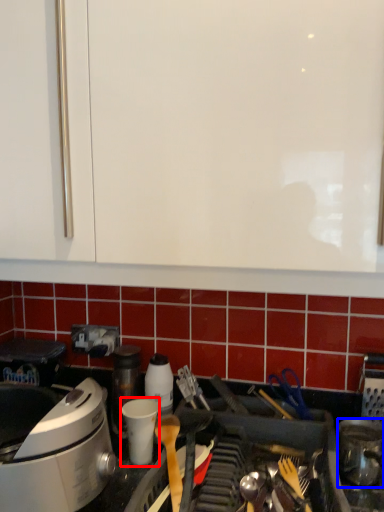
Question: Which of the following is the closest to the observer, appliance (highlighted by a red box) or kitchen appliance (highlighted by a blue box)?

Choices:
 (A) appliance
 (B) kitchen appliance

Answer: (B)